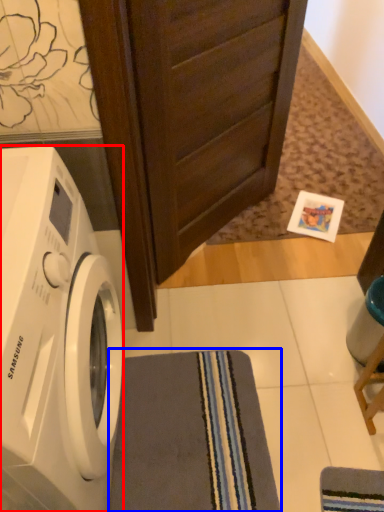
Question: Which object appears closest to the camera in this image, washing machine (highlighted by a red box) or bath towel (highlighted by a blue box)?

Choices:
 (A) washing machine
 (B) bath towel

Answer: (A)